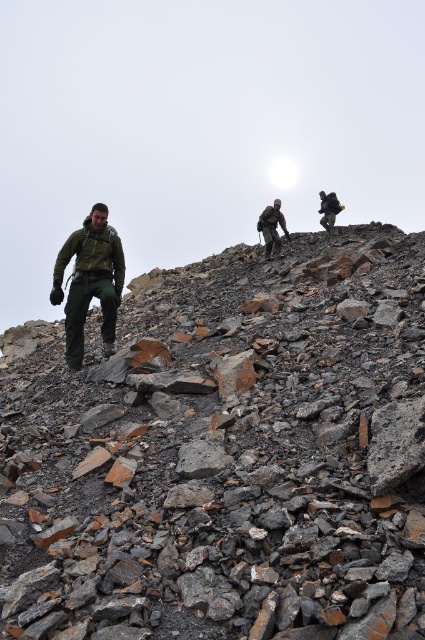
You are a hiker trying to reach the summit. You notice the gray rocky hillside at upper center and the dark green jacket at center. Which object is larger in size?

The gray rocky hillside at upper center is bigger than the dark green jacket at center.

You are part of a hiking group navigating a steep rocky slope. You notice two hikers wearing dark green jackets. One is labeled as dark green jacket at center and the other as dark green jacket at upper center. From your vantage point, which hiker is positioned to the right of the other?

The dark green jacket at center is to the left of dark green jacket at upper center, so the dark green jacket at upper center is positioned to the right of the dark green jacket at center.

You are part of a hiking group and need to pass a narrow rocky path. You see the green matte jacket at left and the dark green jacket at upper center ahead. Which direction should you move to avoid the rocky terrain?

The green matte jacket at left is to the left of the dark green jacket at upper center. To avoid the rocky terrain, move towards the right side of the dark green jacket at upper center since the path might be clearer there.